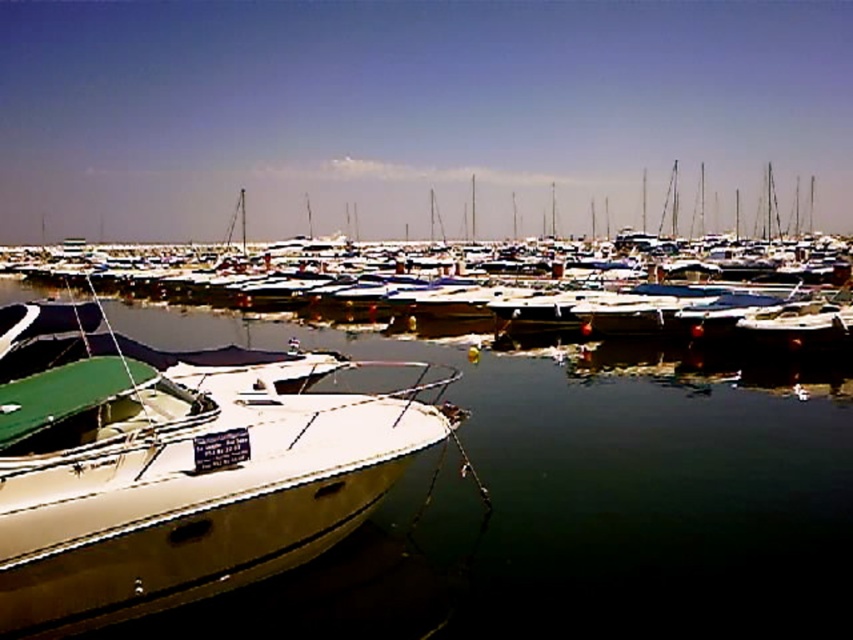
You are standing at the edge of the marina and want to know which of the two points, point (432, 586) or point (660, 280), is closer to you. Can you determine this based on the image?

Point (432, 586) is closer to the camera than point (660, 280), so it is closer to you.

You are a sailor planning to dock your boat at the marina. You see the clear water at boat front and the white glossy boat at center. Which object is located below the other?

The clear water at boat front is positioned under the white glossy boat at center, meaning the water is below the boat.

You are standing on the deck of the white motorboat with a green canopy and want to check the water level at the front of the boat. According to the coordinates provided, where exactly is the clear water at boat front located?

The clear water at boat front is located at coordinates point (582, 522).